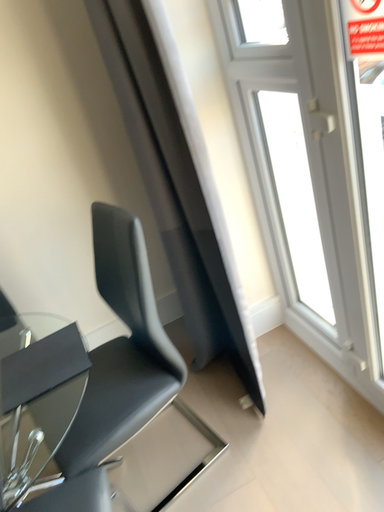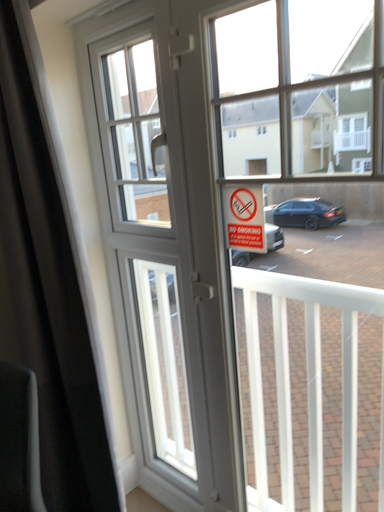
Question: Which way did the camera rotate in the video?

Choices:
 (A) rotated upward
 (B) rotated downward

Answer: (A)